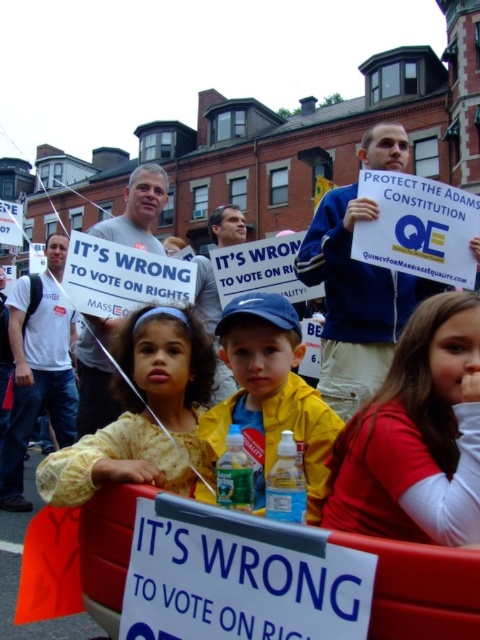
Question: Which point is closer to the camera?

Choices:
 (A) floral-patterned shirt at center
 (B) red cotton shirt at lower right
 (C) yellow fabric jacket at center

Answer: (B)

Question: Is floral-patterned shirt at center smaller than yellow fabric jacket at center?

Choices:
 (A) no
 (B) yes

Answer: (A)

Question: Does floral-patterned shirt at center have a larger size compared to yellow fabric jacket at center?

Choices:
 (A) yes
 (B) no

Answer: (A)

Question: Which point is farther from the camera taking this photo?

Choices:
 (A) (420, 540)
 (B) (265, 424)

Answer: (B)

Question: Can you confirm if red cotton shirt at lower right is positioned to the left of floral-patterned shirt at center?

Choices:
 (A) no
 (B) yes

Answer: (A)

Question: Estimate the real-world distances between objects in this image. Which object is closer to the yellow fabric jacket at center?

Choices:
 (A) red cotton shirt at lower right
 (B) floral-patterned shirt at center

Answer: (B)